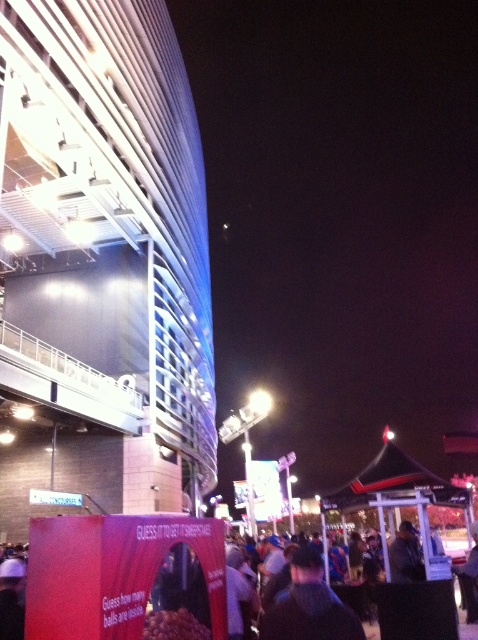
You are at the event and want to take a photo of the shiny metallic balls at center without the dark blue fabric jacket at center blocking the view. Is the jacket currently blocking the balls?

The dark blue fabric jacket at center is taller than shiny metallic balls at center, so the jacket could be blocking the view of the balls depending on the angle and distance. To ensure the jacket isn

You are standing in front of the red promotional booth at night. You see a black matte canopy at center and a dark brown leather jacket at center. Which object is positioned to the right of the other?

The black matte canopy at center is to the right of dark brown leather jacket at center.

You are at the event and want to see the promotional booth clearly. There are two jackets in the way. Which jacket, the dark blue fabric jacket at center or the dark brown leather jacket at center, is taller and thus blocking your view more?

The dark blue fabric jacket at center is much taller than the dark brown leather jacket at center, so it is blocking your view more.